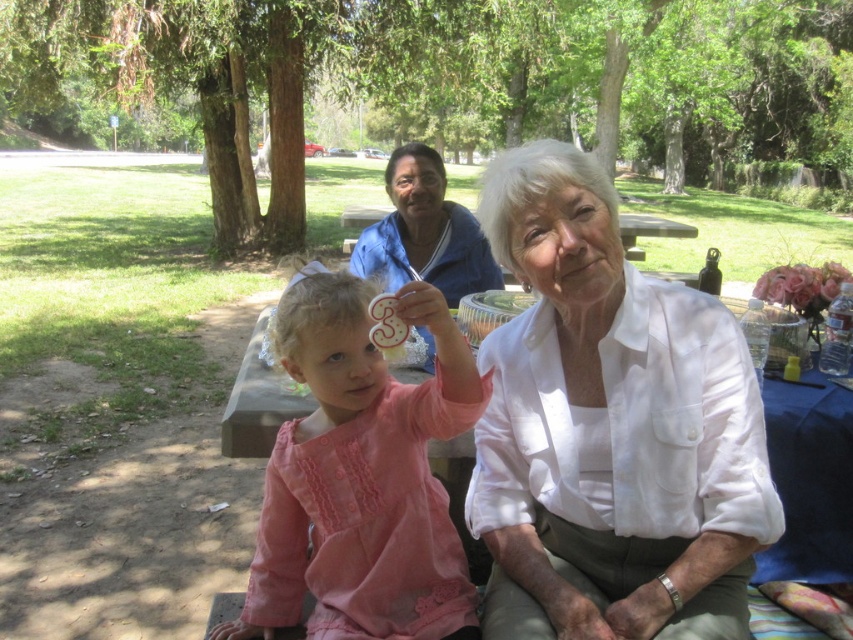
You are a photographer standing in front of the picnic table. You want to take a photo of the pink fabric dress at center and the white cotton shirt at center. Which one will appear larger in the photo?

The pink fabric dress at center will appear larger in the photo because it is closer to the viewer than the white cotton shirt at center.